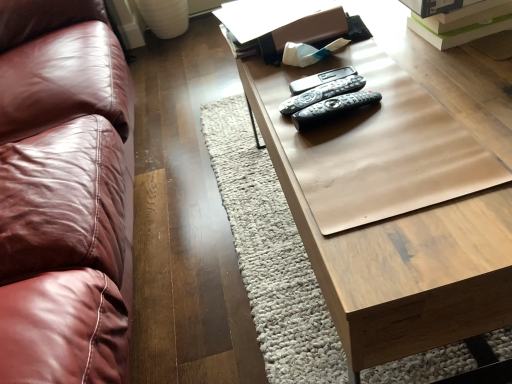
Image resolution: width=512 pixels, height=384 pixels. What do you see at coordinates (399, 193) in the screenshot? I see `wooden table at center` at bounding box center [399, 193].

The image size is (512, 384). What do you see at coordinates (332, 108) in the screenshot? I see `black plastic remotes at center, acting as the third remote starting from the back` at bounding box center [332, 108].

Identify the location of black plastic remotes at center, which appears as the 2th remote when viewed from the front. This screenshot has width=512, height=384. (x=322, y=93).

This screenshot has width=512, height=384. In order to click on black plastic remote at center, the third remote from the front in this screenshot , I will do `click(320, 79)`.

What's the angular difference between wooden table at center and black plastic remote at center, acting as the first remote starting from the back,'s facing directions?

The angle between the facing direction of wooden table at center and the facing direction of black plastic remote at center, acting as the first remote starting from the back, is 4.7 degrees.

Between wooden table at center and black plastic remote at center, the third remote from the front, which one has less height?

black plastic remote at center, the third remote from the front, is shorter.

Considering the sizes of objects wooden table at center and black plastic remote at center, acting as the first remote starting from the back, in the image provided, who is wider, wooden table at center or black plastic remote at center, acting as the first remote starting from the back,?

With larger width is wooden table at center.

Which is more to the left, wooden table at center or black plastic remote at center, the third remote from the front?

Positioned to the left is black plastic remote at center, the third remote from the front.

Which object is positioned more to the left, black plastic remote at center, acting as the first remote starting from the back, or wooden table at center?

From the viewer's perspective, black plastic remote at center, acting as the first remote starting from the back, appears more on the left side.

Is black plastic remote at center, acting as the first remote starting from the back, facing towards wooden table at center?

No, black plastic remote at center, acting as the first remote starting from the back, is not facing towards wooden table at center.

Considering the sizes of objects black plastic remote at center, the third remote from the front, and wooden table at center in the image provided, who is taller, black plastic remote at center, the third remote from the front, or wooden table at center?

wooden table at center is taller.

From the image's perspective, count 3rd remotes upward from the wooden table at center and point to it. Please provide its 2D coordinates.

[(320, 79)]

Which object is wider, black plastic remotes at center, arranged as the 2th remote when viewed from the back, or wooden table at center?

wooden table at center is wider.

Which of these two, black plastic remotes at center, which appears as the 2th remote when viewed from the front, or wooden table at center, stands taller?

Standing taller between the two is wooden table at center.

How many degrees apart are the facing directions of black plastic remotes at center, arranged as the 2th remote when viewed from the back, and wooden table at center?

4.7 degrees separate the facing orientations of black plastic remotes at center, arranged as the 2th remote when viewed from the back, and wooden table at center.

In the image, is black plastic remotes at center, which appears as the 2th remote when viewed from the front, positioned in front of or behind wooden table at center?

black plastic remotes at center, which appears as the 2th remote when viewed from the front, is positioned farther from the viewer than wooden table at center.

In the scene shown: From the image's perspective, is wooden table at center below black plastic remotes at center, which appears as the first remote when viewed from the front?

Correct, wooden table at center appears lower than black plastic remotes at center, which appears as the first remote when viewed from the front, in the image.

Considering the positions of objects wooden table at center and black plastic remotes at center, which appears as the first remote when viewed from the front, in the image provided, who is more to the left, wooden table at center or black plastic remotes at center, which appears as the first remote when viewed from the front,?

From the viewer's perspective, black plastic remotes at center, which appears as the first remote when viewed from the front, appears more on the left side.

You are a GUI agent. You are given a task and a screenshot of the screen. Output one action in this format:
    pyautogui.click(x=<x>, y=<y>)
    Task: Click on the table on the right side of black plastic remotes at center, acting as the third remote starting from the back
    This screenshot has width=512, height=384.
    Given the screenshot: What is the action you would take?
    pyautogui.click(x=399, y=193)

Would you say black plastic remotes at center, which appears as the first remote when viewed from the front, is outside black plastic remotes at center, arranged as the 2th remote when viewed from the back?

black plastic remotes at center, which appears as the first remote when viewed from the front, is positioned outside black plastic remotes at center, arranged as the 2th remote when viewed from the back.

Does point (346, 100) lie in front of point (337, 93)?

Yes, it is.

What's the angular difference between black plastic remotes at center, which appears as the first remote when viewed from the front, and black plastic remotes at center, which appears as the 2th remote when viewed from the front,'s facing directions?

5.28 degrees separate the facing orientations of black plastic remotes at center, which appears as the first remote when viewed from the front, and black plastic remotes at center, which appears as the 2th remote when viewed from the front.

Is black plastic remote at center, the third remote from the front, closer to the viewer compared to black plastic remotes at center, acting as the third remote starting from the back?

No.

Is black plastic remote at center, acting as the first remote starting from the back, taller or shorter than black plastic remotes at center, which appears as the first remote when viewed from the front?

black plastic remote at center, acting as the first remote starting from the back, is shorter than black plastic remotes at center, which appears as the first remote when viewed from the front.

From the image's perspective, between black plastic remote at center, the third remote from the front, and black plastic remotes at center, which appears as the first remote when viewed from the front, which one is located above?

From the image's view, black plastic remote at center, the third remote from the front, is above.

Based on the photo, is there a large distance between black plastic remotes at center, arranged as the 2th remote when viewed from the back, and black plastic remotes at center, which appears as the first remote when viewed from the front?

No, black plastic remotes at center, arranged as the 2th remote when viewed from the back, is not far from black plastic remotes at center, which appears as the first remote when viewed from the front.

Considering the sizes of objects black plastic remotes at center, which appears as the 2th remote when viewed from the front, and black plastic remotes at center, which appears as the first remote when viewed from the front, in the image provided, who is bigger, black plastic remotes at center, which appears as the 2th remote when viewed from the front, or black plastic remotes at center, which appears as the first remote when viewed from the front,?

black plastic remotes at center, which appears as the first remote when viewed from the front, is bigger.

Looking at this image, from their relative heights in the image, would you say black plastic remotes at center, which appears as the 2th remote when viewed from the front, is taller or shorter than black plastic remotes at center, which appears as the first remote when viewed from the front?

In the image, black plastic remotes at center, which appears as the 2th remote when viewed from the front, appears to be shorter than black plastic remotes at center, which appears as the first remote when viewed from the front.

From the image's perspective, which one is positioned higher, black plastic remotes at center, arranged as the 2th remote when viewed from the back, or black plastic remotes at center, acting as the third remote starting from the back?

black plastic remotes at center, arranged as the 2th remote when viewed from the back, is shown above in the image.

Locate an element on the screen. The image size is (512, 384). the 3rd remote above the wooden table at center (from the image's perspective) is located at coordinates (320, 79).

The image size is (512, 384). Identify the location of table on the right of black plastic remote at center, acting as the first remote starting from the back. (399, 193).

Which object lies nearer to the anchor point black plastic remotes at center, arranged as the 2th remote when viewed from the back, black plastic remote at center, acting as the first remote starting from the back, or wooden table at center?

The object closer to black plastic remotes at center, arranged as the 2th remote when viewed from the back, is black plastic remote at center, acting as the first remote starting from the back.

Looking at the image, which one is located closer to black plastic remotes at center, acting as the third remote starting from the back, wooden table at center or black plastic remotes at center, which appears as the 2th remote when viewed from the front?

black plastic remotes at center, which appears as the 2th remote when viewed from the front.

Based on their spatial positions, is black plastic remote at center, the third remote from the front, or black plastic remotes at center, which appears as the 2th remote when viewed from the front, further from black plastic remotes at center, acting as the third remote starting from the back?

Among the two, black plastic remote at center, the third remote from the front, is located further to black plastic remotes at center, acting as the third remote starting from the back.

When comparing their distances from black plastic remotes at center, acting as the third remote starting from the back, does black plastic remotes at center, arranged as the 2th remote when viewed from the back, or black plastic remote at center, the third remote from the front, seem further?

The object further to black plastic remotes at center, acting as the third remote starting from the back, is black plastic remote at center, the third remote from the front.

Estimate the real-world distances between objects in this image. Which object is further from black plastic remote at center, the third remote from the front, black plastic remotes at center, acting as the third remote starting from the back, or wooden table at center?

Based on the image, wooden table at center appears to be further to black plastic remote at center, the third remote from the front.

Based on their spatial positions, is black plastic remote at center, acting as the first remote starting from the back, or wooden table at center closer to black plastic remotes at center, which appears as the first remote when viewed from the front?

black plastic remote at center, acting as the first remote starting from the back, is positioned closer to the anchor black plastic remotes at center, which appears as the first remote when viewed from the front.

Based on the photo, from the image, which object appears to be nearer to black plastic remotes at center, which appears as the first remote when viewed from the front, wooden table at center or black plastic remote at center, the third remote from the front?

Based on the image, black plastic remote at center, the third remote from the front, appears to be nearer to black plastic remotes at center, which appears as the first remote when viewed from the front.

Based on their spatial positions, is black plastic remote at center, acting as the first remote starting from the back, or black plastic remotes at center, arranged as the 2th remote when viewed from the back, further from wooden table at center?

black plastic remote at center, acting as the first remote starting from the back, is positioned further to the anchor wooden table at center.

Locate an element on the screen. The height and width of the screenshot is (384, 512). remote positioned between black plastic remotes at center, acting as the third remote starting from the back, and black plastic remote at center, the third remote from the front, from near to far is located at coordinates (322, 93).

Locate an element on the screen. The height and width of the screenshot is (384, 512). remote between wooden table at center and black plastic remotes at center, arranged as the 2th remote when viewed from the back, along the z-axis is located at coordinates (332, 108).